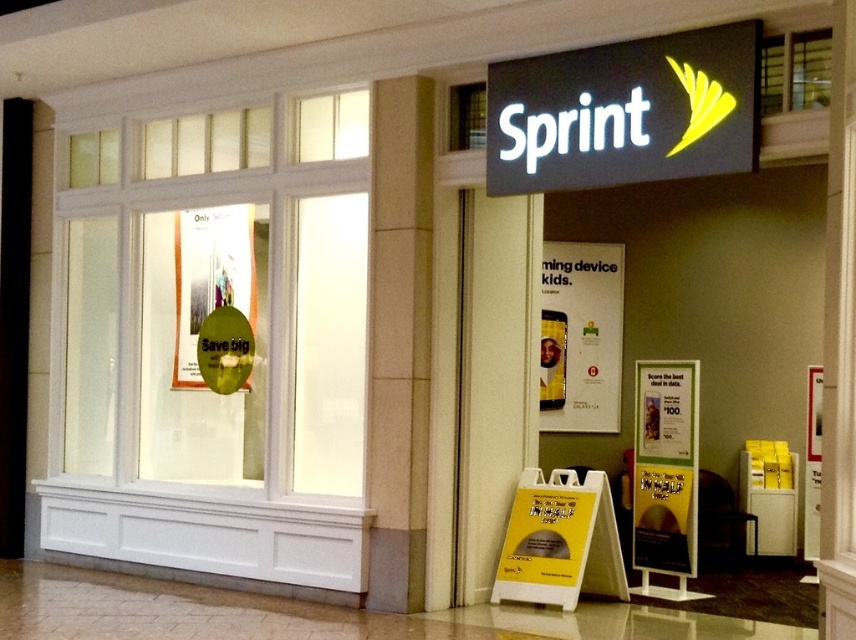
Question: Which point is farther from the camera taking this photo?

Choices:
 (A) (218, 230)
 (B) (554, 308)
 (C) (694, 424)
 (D) (658, 83)

Answer: (B)

Question: Can you confirm if yellow paper sign at center is bigger than green glossy sign at upper left?

Choices:
 (A) no
 (B) yes

Answer: (A)

Question: Is yellow paper sign at center smaller than green glossy sign at upper left?

Choices:
 (A) yes
 (B) no

Answer: (A)

Question: Which point is farther to the camera?

Choices:
 (A) (593, 112)
 (B) (203, 282)
 (C) (675, 566)

Answer: (B)

Question: Which object is farther from the camera taking this photo?

Choices:
 (A) white paper sign at center
 (B) yellow paper sign at center
 (C) green glossy sign at upper left
 (D) black matte sign at upper center

Answer: (A)

Question: From the image, what is the correct spatial relationship of white paper sign at center in relation to green glossy sign at upper left?

Choices:
 (A) left
 (B) right

Answer: (B)